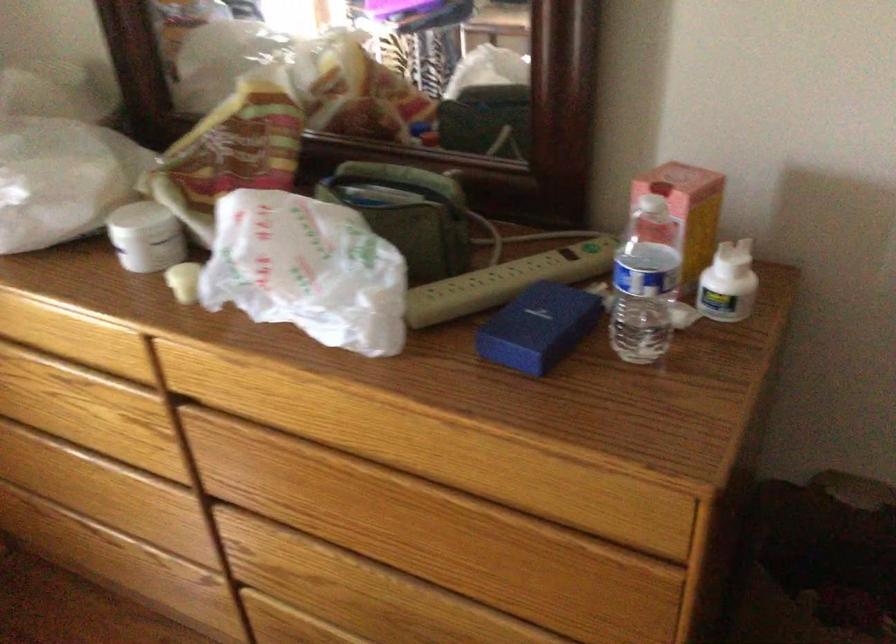
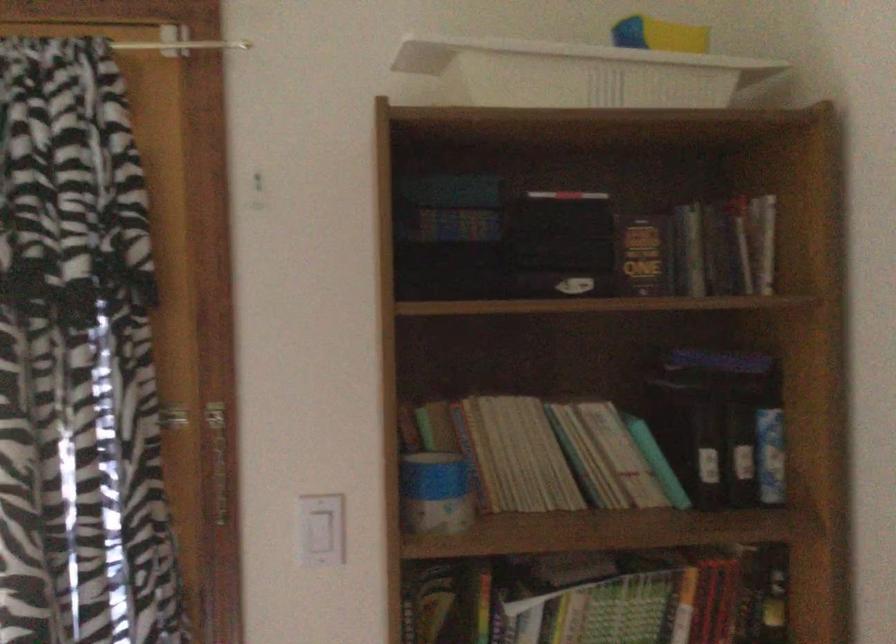
The images are taken continuously from a first-person perspective. In which direction is your viewpoint rotating?

The rotation direction of the camera is left-up.